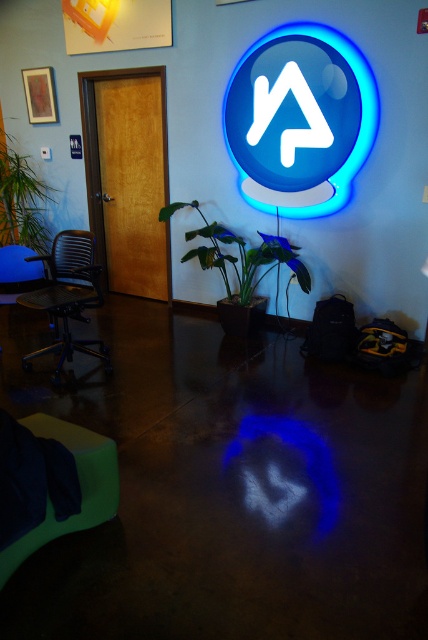
You are standing in the lobby and see the green glossy plant at center and the green leafy plant at left. Which plant is positioned lower in the image?

The green glossy plant at center is positioned lower than the green leafy plant at left.

You are standing in the lobby and need to move from the green fabric swivel chair at lower left to the blue glass neon sign at upper center. Which direction should you move to reach it?

To reach the blue glass neon sign at upper center from the green fabric swivel chair at lower left, you should move to the right since the blue glass neon sign at upper center is located to the right of the green fabric swivel chair at lower left.

You are standing in the lobby and want to water the green glossy plant at center. If your watering can has a maximum reach of 3.5 meters, can you reach the plant without moving closer?

The green glossy plant at center is 3.91 meters away from the viewer, which is beyond the watering can reach of 3.5 meters. Therefore, you cannot reach it without moving closer.